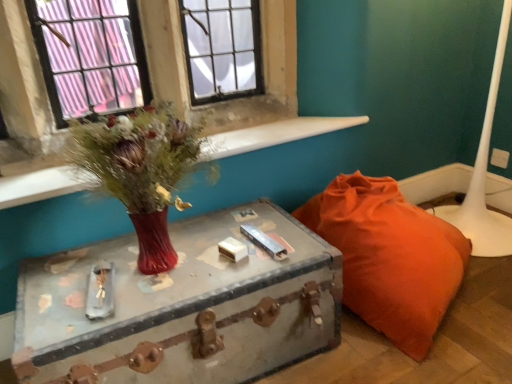
Question: Considering the positions of matte red vase at upper left and matte glass vase at upper left in the image, is matte red vase at upper left wider or thinner than matte glass vase at upper left?

Choices:
 (A) wide
 (B) thin

Answer: (A)

Question: Is point (113, 167) closer or farther from the camera than point (236, 147)?

Choices:
 (A) farther
 (B) closer

Answer: (B)

Question: Which object is positioned closest to the matte red vase at upper left?

Choices:
 (A) white glossy table lamp at lower right
 (B) rusty metal trunk at center
 (C) orange fabric bean bag at lower right
 (D) matte glass vase at upper left

Answer: (B)

Question: Which of these objects is positioned farthest from the rusty metal trunk at center?

Choices:
 (A) white glossy table lamp at lower right
 (B) matte red vase at upper left
 (C) matte glass vase at upper left
 (D) orange fabric bean bag at lower right

Answer: (A)